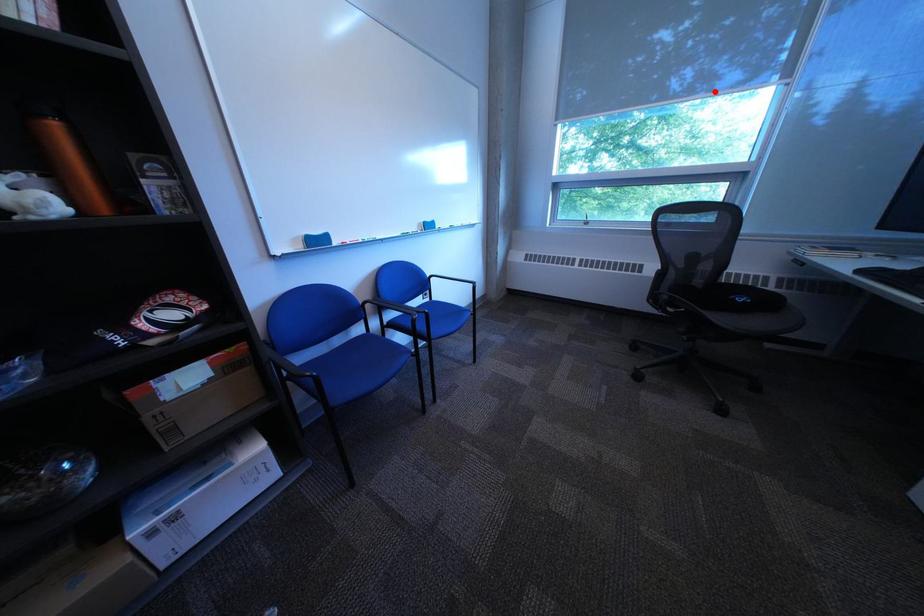
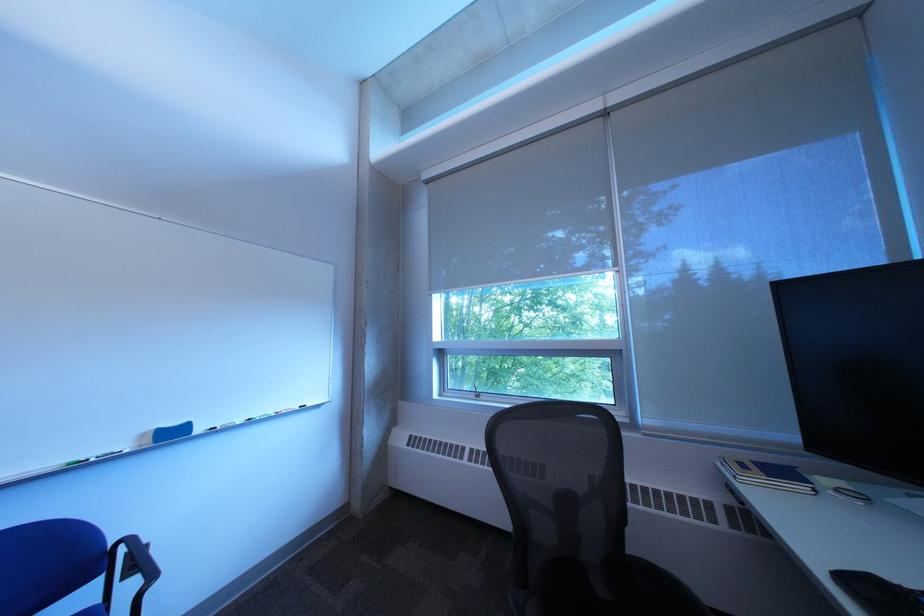
The point at the highlighted location is marked in the first image. Where is the corresponding point in the second image?

(611, 267)